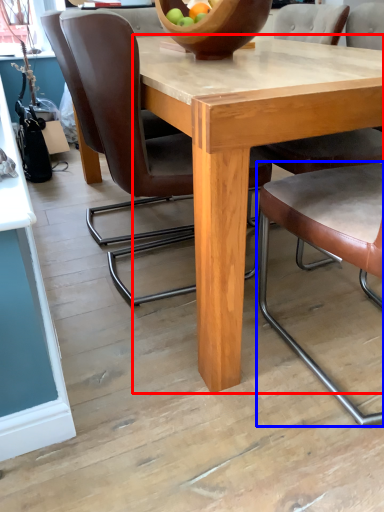
Question: Which object appears closest to the camera in this image, round table (highlighted by a red box) or chair (highlighted by a blue box)?

Choices:
 (A) round table
 (B) chair

Answer: (B)